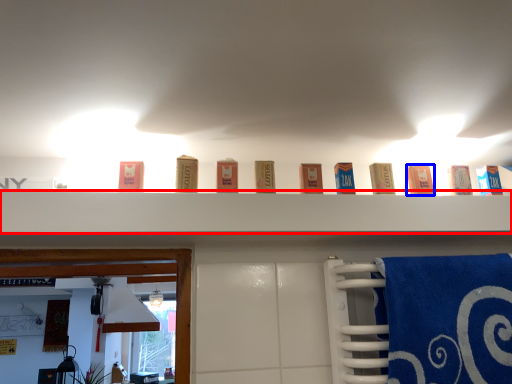
Question: Which object is further to the camera taking this photo, shelf (highlighted by a red box) or product (highlighted by a blue box)?

Choices:
 (A) shelf
 (B) product

Answer: (B)